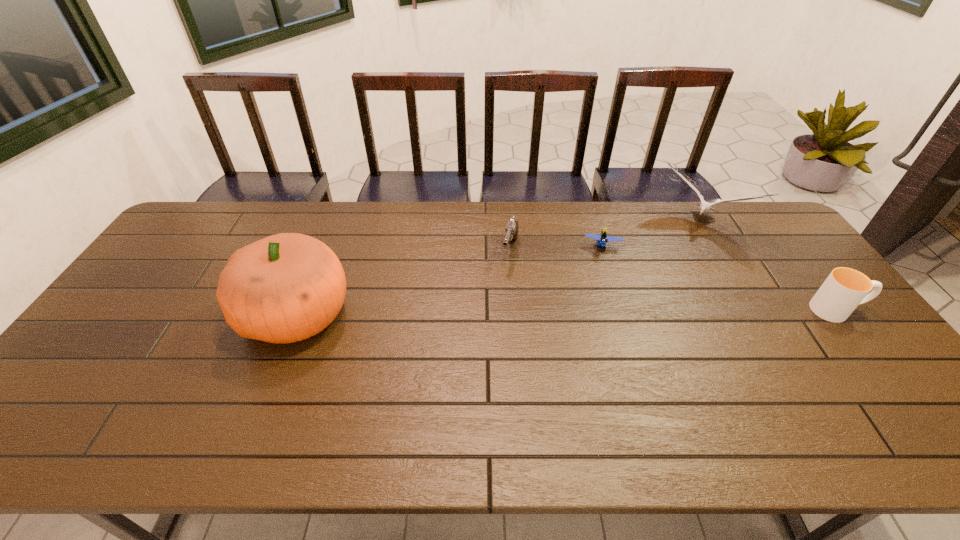
Find the location of `vacant space on the desktop that is between the tallest object and the cup and is positioned on the front-facing side of the shortest object`. vacant space on the desktop that is between the tallest object and the cup and is positioned on the front-facing side of the shortest object is located at coordinates (601, 312).

This screenshot has width=960, height=540. In order to click on vacant space on the desktop that is between the pumpkin and the rightmost object and is positioned at the barrel of the pistol in this screenshot , I will do `click(491, 313)`.

This screenshot has width=960, height=540. In order to click on vacant space on the desktop that is between the tallest object and the cup and is positioned at the tip of the beak of the second object from right to left in this screenshot , I will do tap(641, 312).